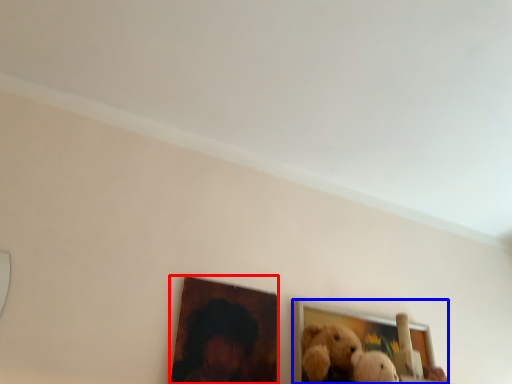
Question: Which object is further to the camera taking this photo, picture frame (highlighted by a red box) or picture frame (highlighted by a blue box)?

Choices:
 (A) picture frame
 (B) picture frame

Answer: (B)